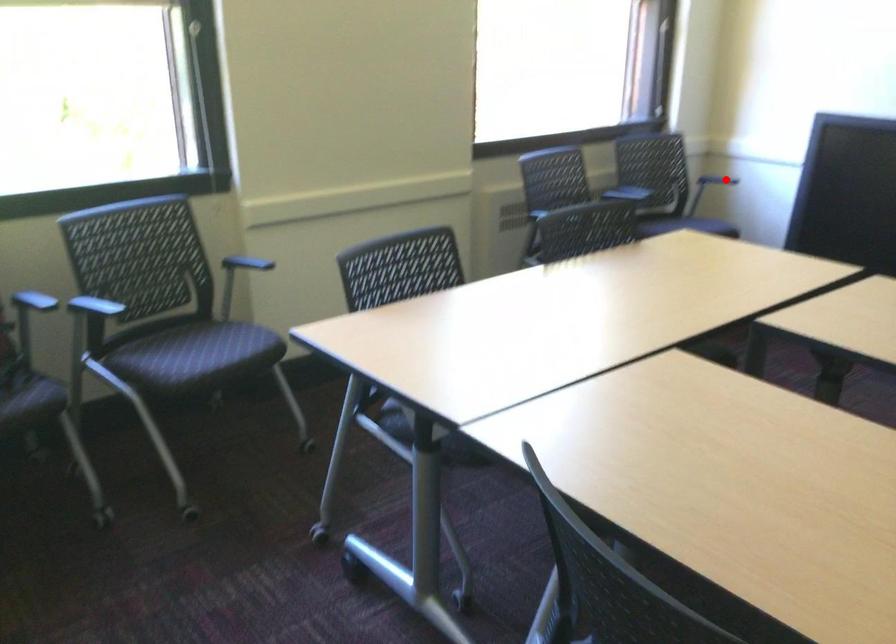
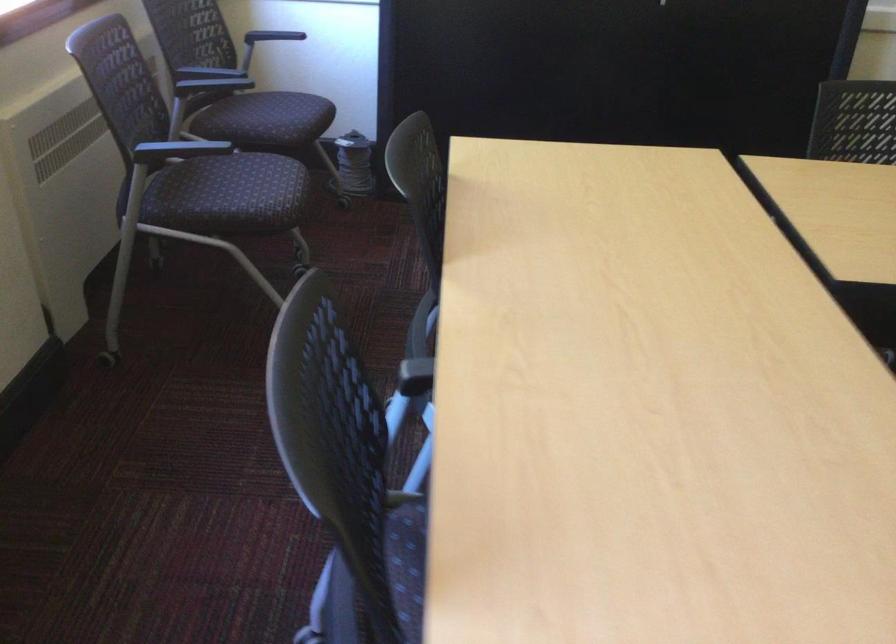
Find the pixel in the second image that matches the highlighted location in the first image.

(270, 38)